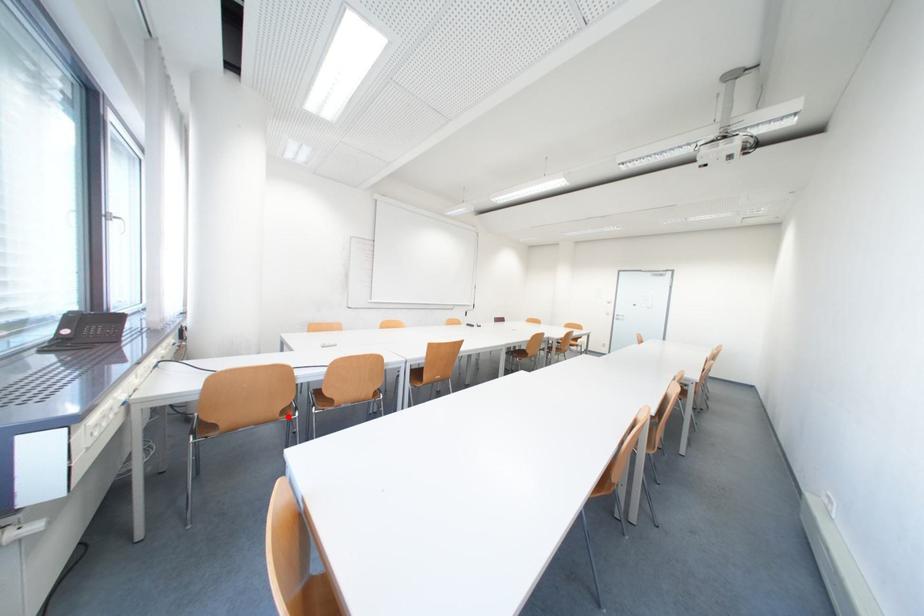
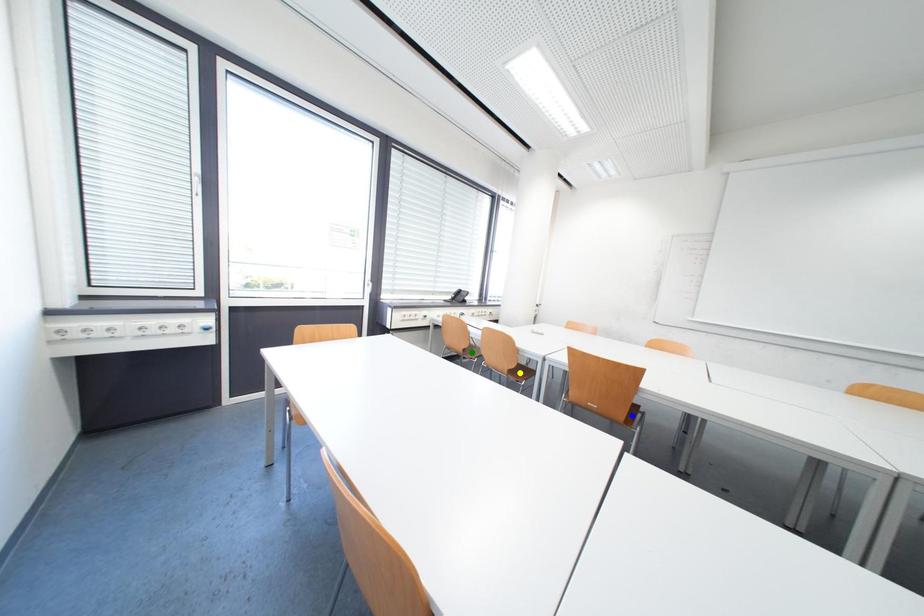
Question: I am providing you with two images of the same scene from different viewpoints. A red point is marked on the first image. You are given multiple points on the second image. Which point in image 2 is actually the same real-world point as the red point in image 1?

Choices:
 (A) blue point
 (B) yellow point
 (C) green point

Answer: (C)